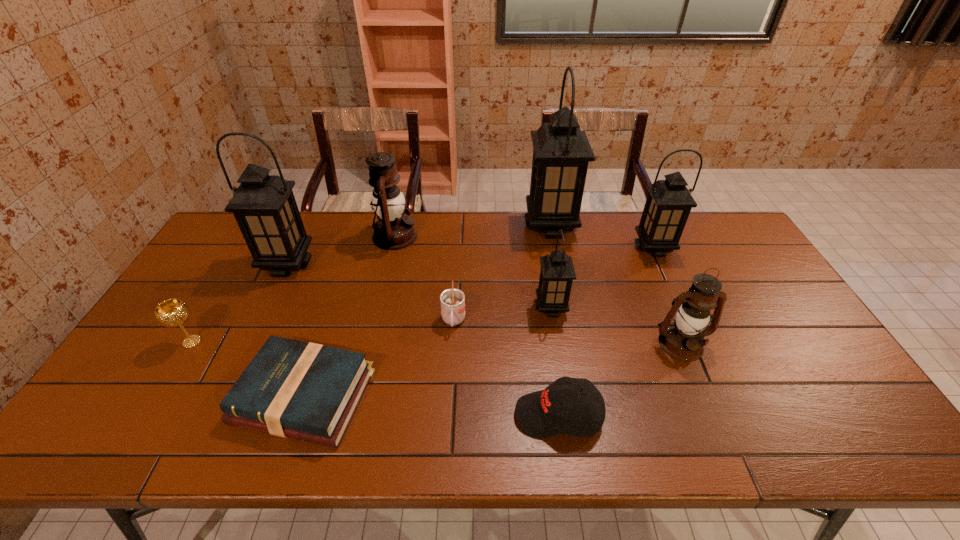
Where is `hardback book that is positioned at the near edge`? hardback book that is positioned at the near edge is located at coordinates (293, 389).

You are a GUI agent. You are given a task and a screenshot of the screen. Output one action in this format:
    pyautogui.click(x=<x>, y=<y>)
    Task: Click on the object located at the left edge
    This screenshot has height=540, width=960.
    Given the screenshot: What is the action you would take?
    [173, 312]

Find the location of a particular element. This screenshot has width=960, height=540. vacant position at the far edge of the desktop is located at coordinates (367, 244).

Find the location of a particular element. This screenshot has height=540, width=960. vacant space at the near edge of the desktop is located at coordinates (792, 447).

Image resolution: width=960 pixels, height=540 pixels. Find the location of `vacant space at the left edge of the desktop`. vacant space at the left edge of the desktop is located at coordinates (222, 268).

Identify the location of free space at the right edge of the desktop. (740, 284).

You are a GUI agent. You are given a task and a screenshot of the screen. Output one action in this format:
    pyautogui.click(x=<x>, y=<y>)
    Task: Click on the vacant space at the far right corner of the desktop
    
    Given the screenshot: What is the action you would take?
    pyautogui.click(x=718, y=248)

The image size is (960, 540). I want to click on blank region between the chalice and the third smallest black lantern, so click(240, 303).

This screenshot has width=960, height=540. I want to click on free area in between the shortest object and the tallest object, so click(x=427, y=311).

The width and height of the screenshot is (960, 540). What are the coordinates of `free space between the right brown lantern and the nearest black lantern` in the screenshot? It's located at (616, 326).